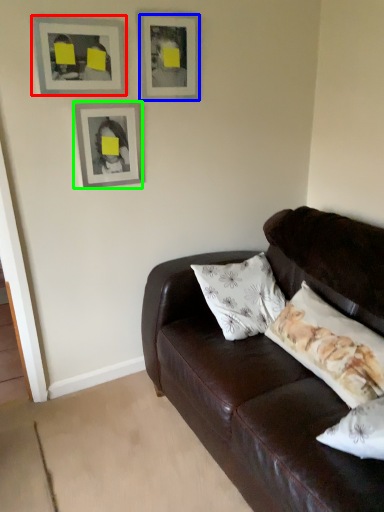
Question: Considering the real-world distances, which object is farthest from picture frame (highlighted by a red box)? picture frame (highlighted by a blue box) or picture frame (highlighted by a green box)?

Choices:
 (A) picture frame
 (B) picture frame

Answer: (A)